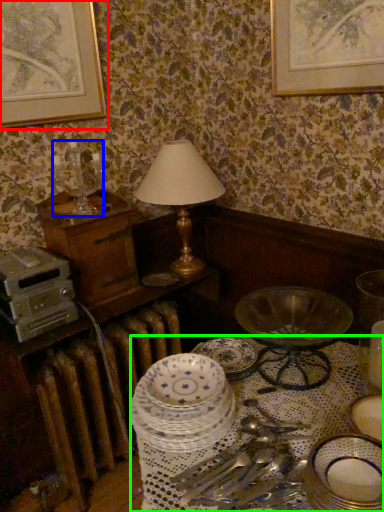
Question: Which object is positioned farthest from picture frame (highlighted by a red box)? Select from candle holder (highlighted by a blue box) and round table (highlighted by a green box).

Choices:
 (A) candle holder
 (B) round table

Answer: (B)